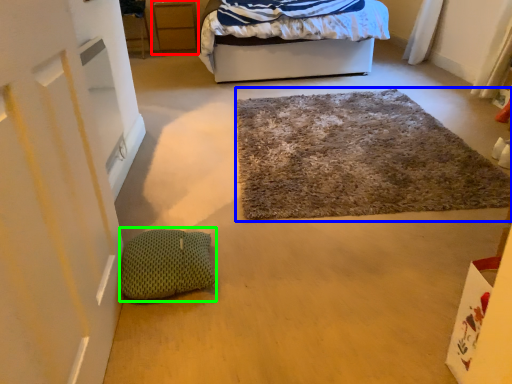
Question: Which is farther away from cabinetry (highlighted by a red box)? door (highlighted by a blue box) or pillow (highlighted by a green box)?

Choices:
 (A) door
 (B) pillow

Answer: (B)